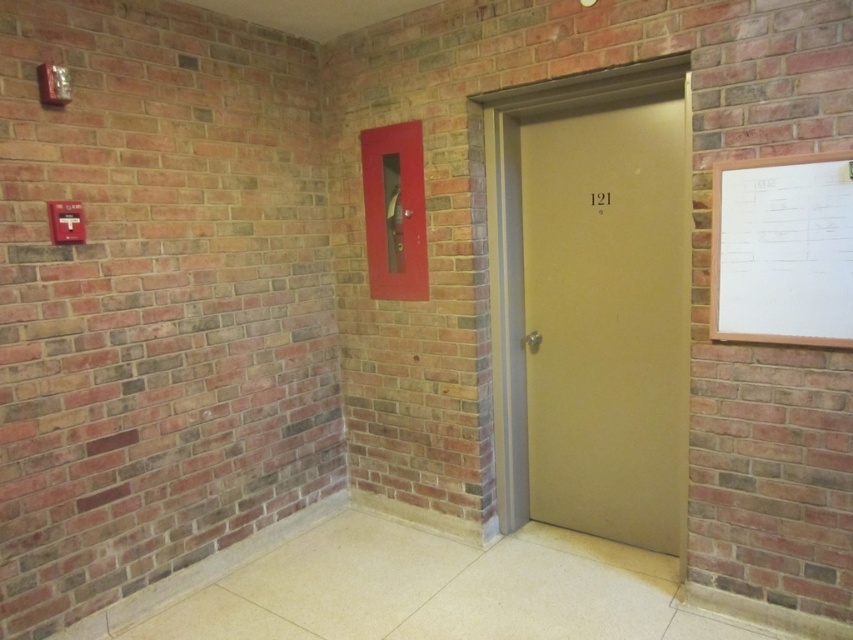
You are a painter who needs to move a ladder from the matte beige door at center to the white wooden board at upper right. Which object is wider so that the ladder can be placed stably against it?

The matte beige door at center is wider than the white wooden board at upper right, so the ladder can be placed stably against the matte beige door at center.

You are a maintenance worker in the hallway. You need to check both the white wooden board at upper right and the metallic red fire extinguisher at center. Which object should you check first if you want to start from the one closer to the floor?

The white wooden board at upper right is below the metallic red fire extinguisher at center, so it is closer to the floor. Therefore, you should check the white wooden board at upper right first.